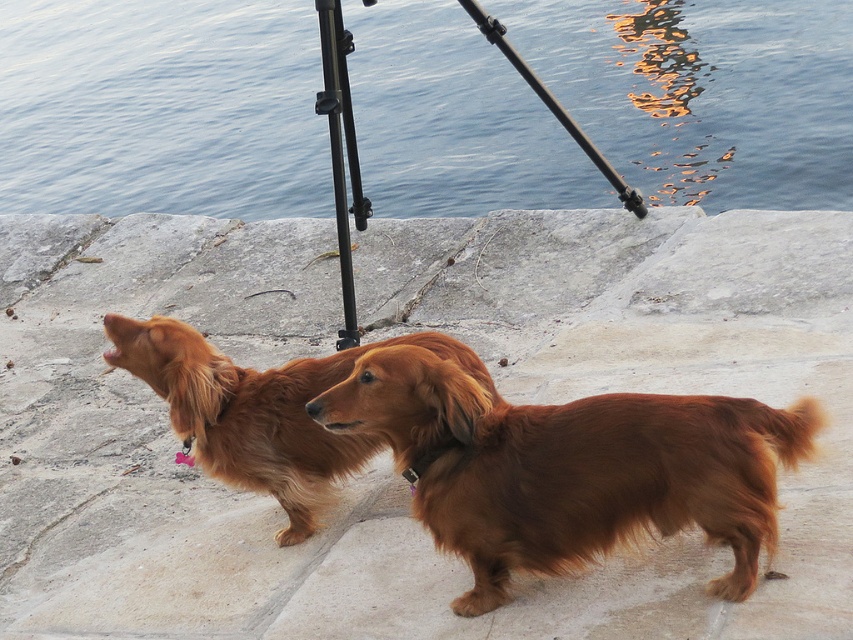
Looking at this image, can you confirm if smooth concrete stone at center is taller than brown furry dog at center?

Yes.

Is smooth concrete stone at center below brown furry dog at center?

Actually, smooth concrete stone at center is above brown furry dog at center.

Which is behind, point (641, 385) or point (532, 488)?

Point (641, 385)

In order to click on smooth concrete stone at center in this screenshot , I will do point(387,454).

You are a GUI agent. You are given a task and a screenshot of the screen. Output one action in this format:
    pyautogui.click(x=<x>, y=<y>)
    Task: Click on the brown furry dog at center
    
    Given the screenshot: What is the action you would take?
    570,467

Does brown furry dog at center have a smaller size compared to black metal tripod at center?

Yes.

I want to click on brown furry dog at center, so coord(570,467).

Does blue water at upper center have a lesser height compared to black metal tripod at center?

Yes.

Measure the distance between blue water at upper center and black metal tripod at center.

blue water at upper center and black metal tripod at center are 14.78 feet apart from each other.

Identify the location of blue water at upper center. (161, 108).